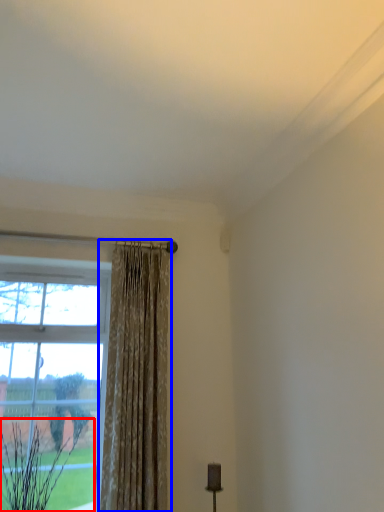
Question: Among these objects, which one is farthest to the camera, plant (highlighted by a red box) or curtain (highlighted by a blue box)?

Choices:
 (A) plant
 (B) curtain

Answer: (B)